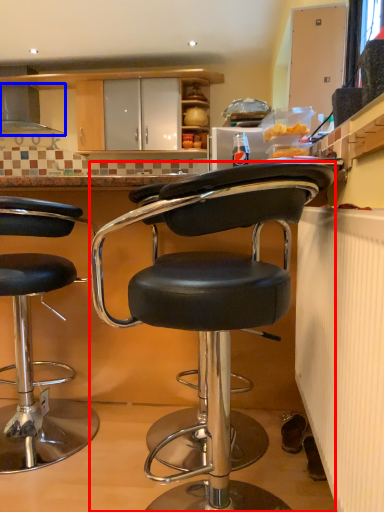
Question: Which object is closer to the camera taking this photo, chair (highlighted by a red box) or exhaust hood (highlighted by a blue box)?

Choices:
 (A) chair
 (B) exhaust hood

Answer: (A)